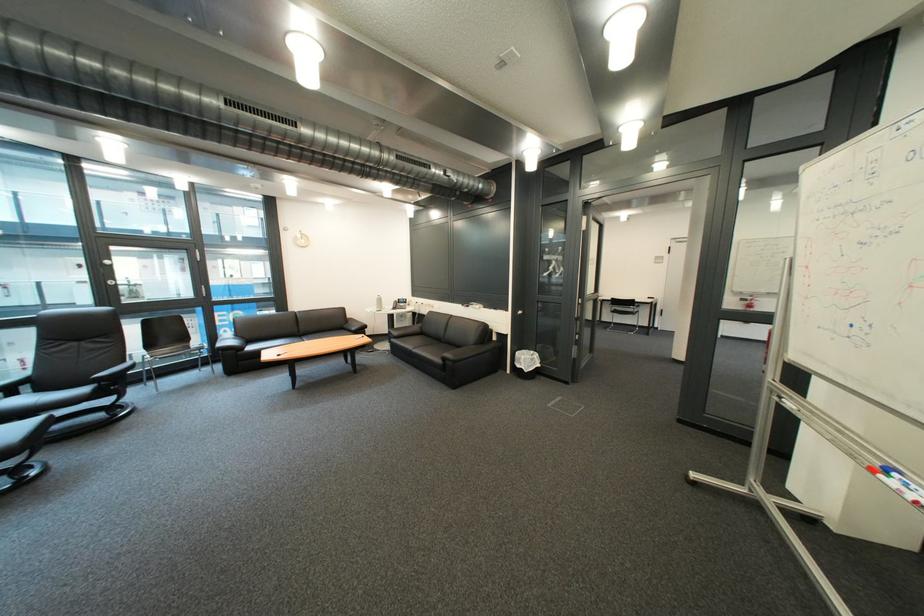
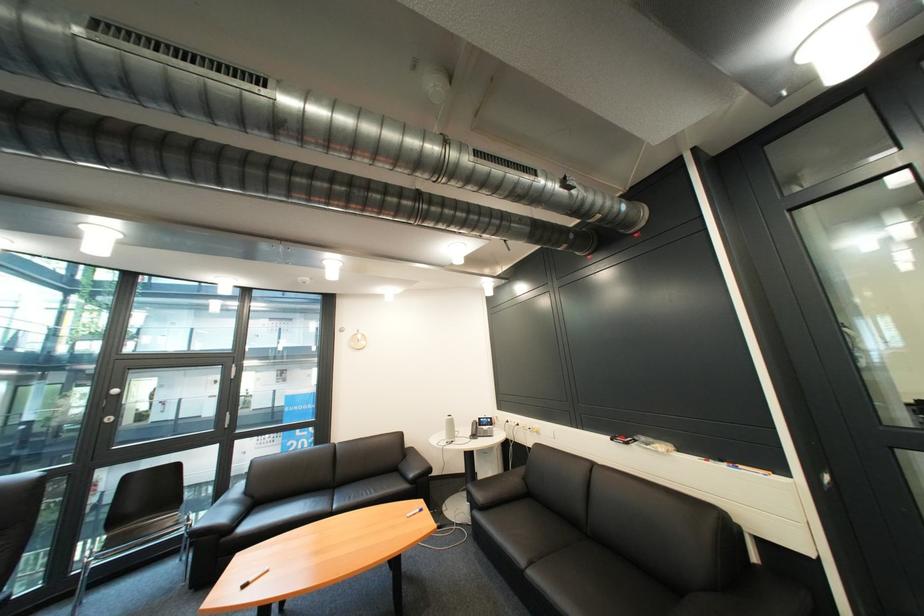
The point at (436, 305) is marked in the first image. Where is the corresponding point in the second image?

(531, 426)